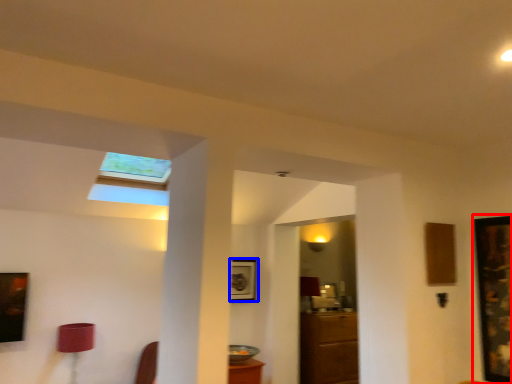
Question: Which point is further to the camera, picture frame (highlighted by a red box) or picture frame (highlighted by a blue box)?

Choices:
 (A) picture frame
 (B) picture frame

Answer: (B)